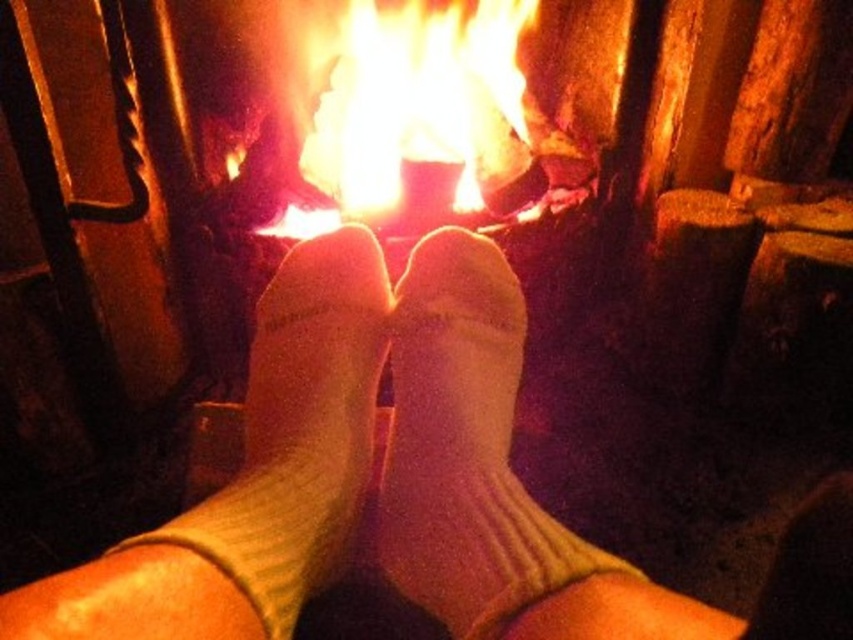
You are standing in front of a fireplace and see the white ribbed socks at center. If you want to place a small decorative item exactly where the white ribbed socks are currently located, what coordinates should you use?

You should use the coordinates point (405, 484) where the white ribbed socks at center are located.

You are a fire safety inspector checking the distance between the white ribbed socks at center and the white knit socks at center near the fire. According to safety guidelines, flammable materials must be kept at least 5 centimeters away from the fire. Is the current distance compliant with the safety guidelines?

The white ribbed socks at center is 3.30 centimeters away from white knit socks at center. Since the required distance is 5 centimeters, the current spacing is insufficient and does not meet safety guidelines.